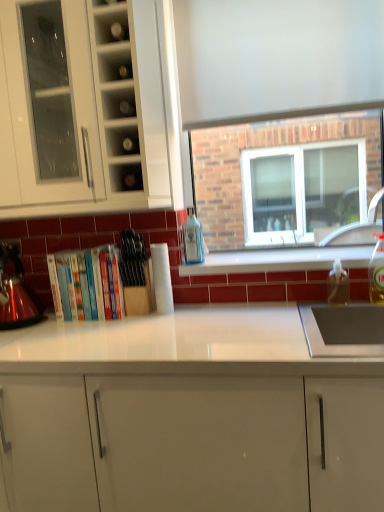
Where is `spots to the right of white paper towel at center`? spots to the right of white paper towel at center is located at coordinates (201, 313).